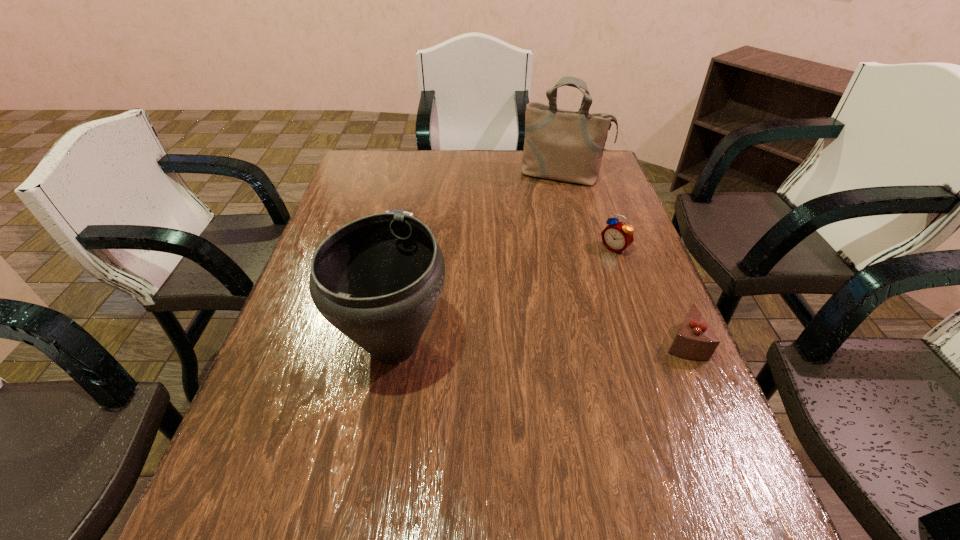
Find the location of a particular element. The image size is (960, 540). chocolate cake located in the right edge section of the desktop is located at coordinates (695, 340).

Where is `alarm clock positioned at the right edge`? Image resolution: width=960 pixels, height=540 pixels. alarm clock positioned at the right edge is located at coordinates (617, 236).

You are a GUI agent. You are given a task and a screenshot of the screen. Output one action in this format:
    pyautogui.click(x=<x>, y=<y>)
    Task: Click on the shoulder bag that is at the right edge
    
    Given the screenshot: What is the action you would take?
    pyautogui.click(x=562, y=145)

This screenshot has width=960, height=540. I want to click on object at the far right corner, so click(x=562, y=145).

Locate an element on the screen. This screenshot has height=540, width=960. free space at the far edge is located at coordinates (424, 162).

The width and height of the screenshot is (960, 540). In order to click on free space at the near edge of the desktop in this screenshot , I will do `click(597, 475)`.

Image resolution: width=960 pixels, height=540 pixels. Identify the location of free region at the left edge of the desktop. (345, 209).

Where is `vacant space at the right edge`? This screenshot has height=540, width=960. vacant space at the right edge is located at coordinates (677, 420).

Identify the location of blank space at the far left corner. (384, 178).

Find the location of a particular element. The height and width of the screenshot is (540, 960). vacant area at the near left corner is located at coordinates (245, 457).